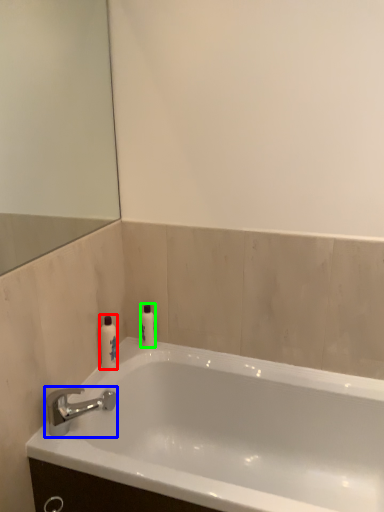
Question: Which is farther away from toiletry (highlighted by a red box)? tap (highlighted by a blue box) or toiletry (highlighted by a green box)?

Choices:
 (A) tap
 (B) toiletry

Answer: (A)